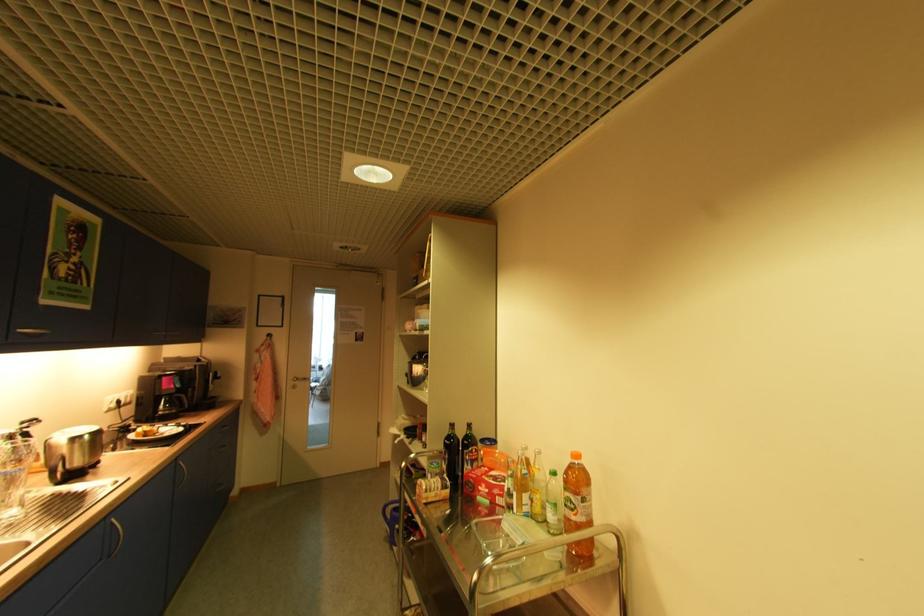
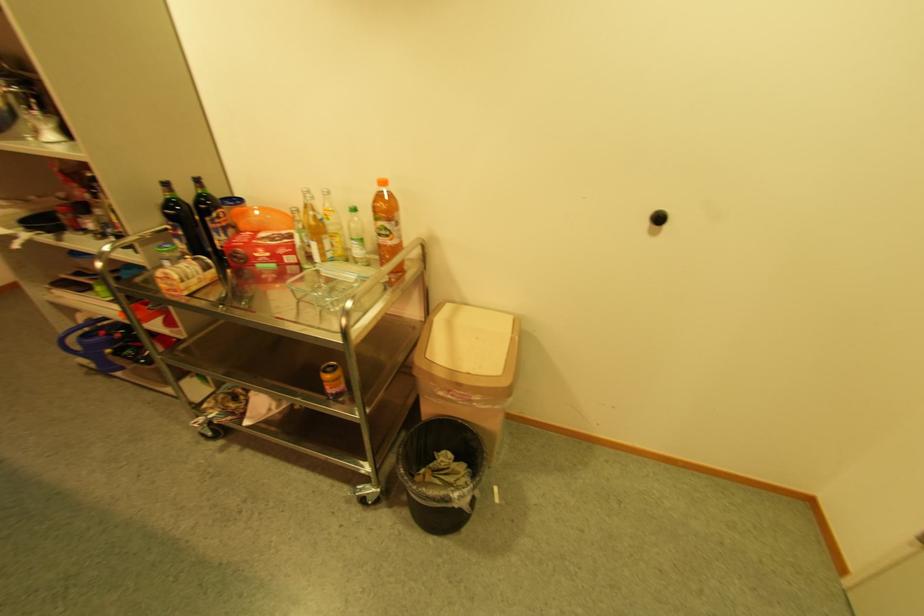
Where in the second image is the point corresponding to the point at 451,445 from the first image?

(172, 217)